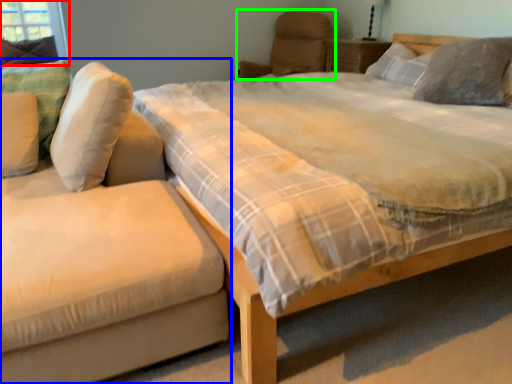
Question: Which is nearer to the window screen (highlighted by a red box)? studio couch (highlighted by a blue box) or armchair (highlighted by a green box).

Choices:
 (A) studio couch
 (B) armchair

Answer: (B)